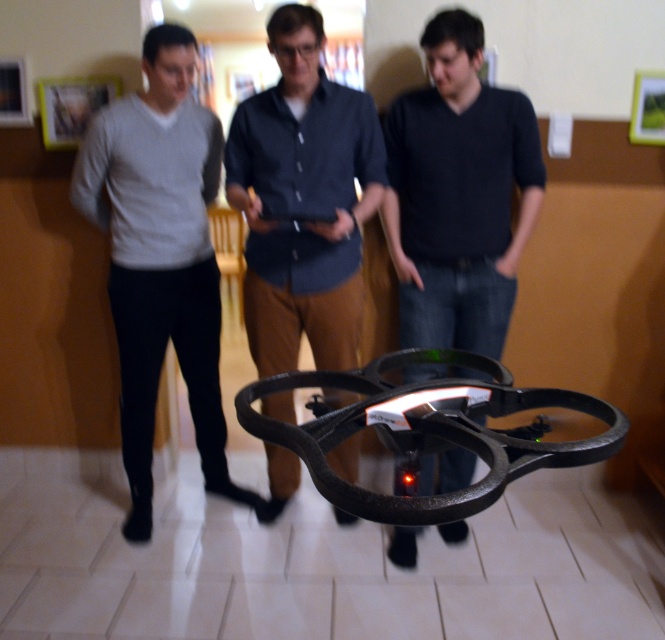
Question: Does dark gray sweater at center lie in front of dark blue shirt at center?

Choices:
 (A) yes
 (B) no

Answer: (B)

Question: Which point appears closest to the camera in this image?

Choices:
 (A) (98, 144)
 (B) (277, 35)

Answer: (B)

Question: Where is dark gray sweater at center located in relation to dark blue shirt at center in the image?

Choices:
 (A) below
 (B) above

Answer: (B)

Question: Which point is farther to the camera?

Choices:
 (A) dark gray sweater at center
 (B) dark blue shirt at center

Answer: (A)

Question: Based on their relative distances, which object is nearer to the dark blue shirt at center?

Choices:
 (A) dark gray sweater at center
 (B) matte gray sweater at left

Answer: (B)

Question: Can you confirm if matte gray sweater at left is positioned to the left of dark gray sweater at center?

Choices:
 (A) no
 (B) yes

Answer: (B)